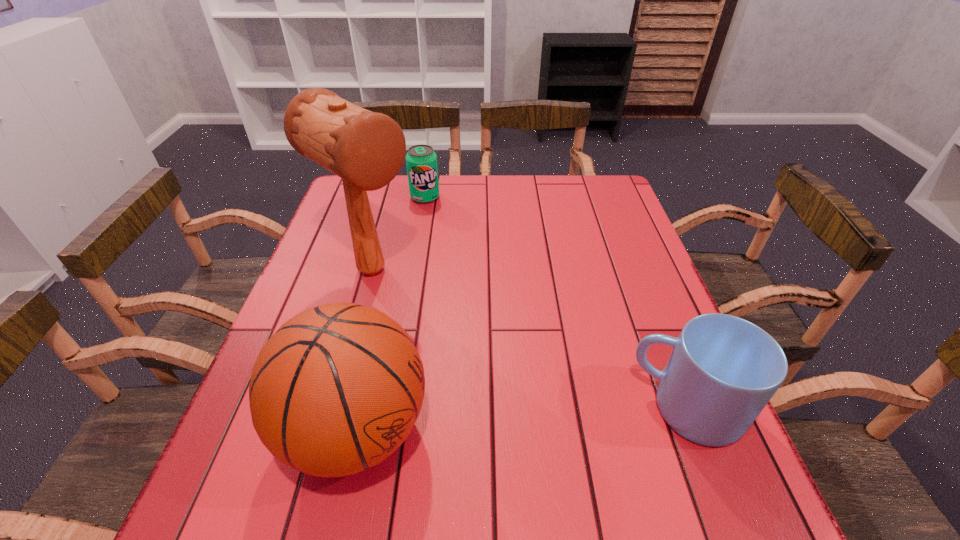
The height and width of the screenshot is (540, 960). What are the coordinates of `free point that satisfies the following two spatial constraints: 1. on the front side of the farthest object; 2. on the right side of the mug` in the screenshot? It's located at (389, 410).